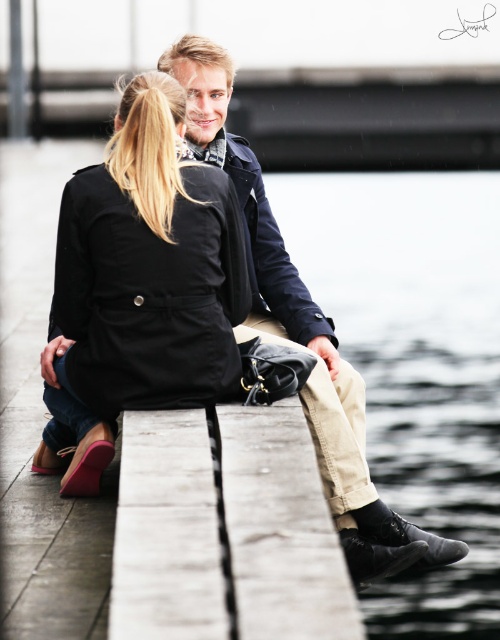
Can you confirm if black leather shoes at lower center is positioned below dark blue denim jacket at center?

No, black leather shoes at lower center is not below dark blue denim jacket at center.

Can you confirm if black leather shoes at lower center is thinner than dark blue denim jacket at center?

Incorrect, black leather shoes at lower center's width is not less than dark blue denim jacket at center's.

The width and height of the screenshot is (500, 640). What do you see at coordinates (416, 365) in the screenshot?
I see `black leather shoes at lower center` at bounding box center [416, 365].

Find the location of a particular element. The width and height of the screenshot is (500, 640). black leather shoes at lower center is located at coordinates (416, 365).

Is weathered wood dock at center further to camera compared to dark blue denim jacket at center?

No, weathered wood dock at center is in front of dark blue denim jacket at center.

The image size is (500, 640). Identify the location of weathered wood dock at center. (226, 529).

Where is `weathered wood dock at center`? weathered wood dock at center is located at coordinates (226, 529).

The height and width of the screenshot is (640, 500). In order to click on weathered wood dock at center in this screenshot , I will do `click(226, 529)`.

Can you confirm if matte black coat at center is thinner than weathered wood dock at center?

No, matte black coat at center is not thinner than weathered wood dock at center.

Who is more distant from viewer, (145, 246) or (123, 444)?

The point (145, 246) is behind.

The width and height of the screenshot is (500, 640). Find the location of `matte black coat at center`. matte black coat at center is located at coordinates (140, 285).